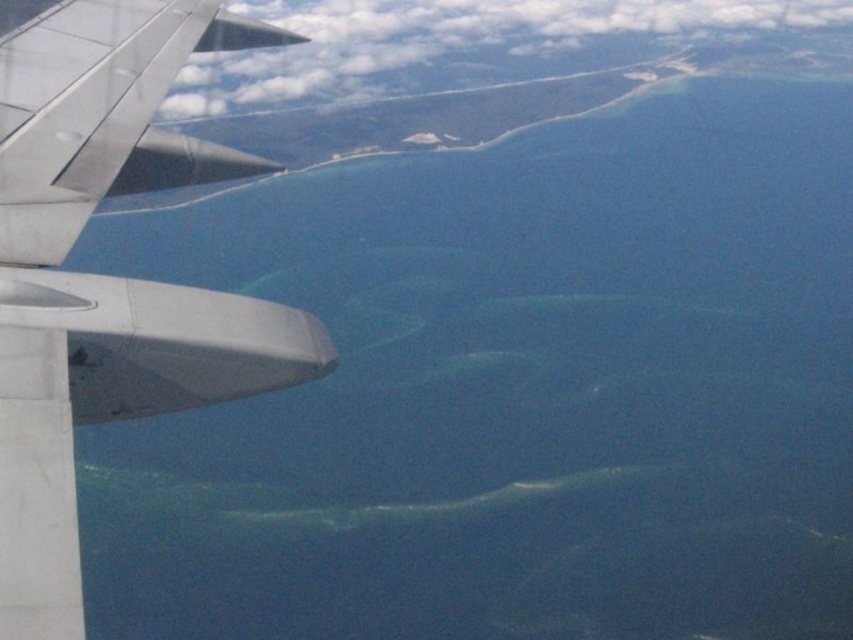
Is point (247, 365) farther from camera compared to point (312, 77)?

No, it is in front of (312, 77).

Is metallic gray wing at left thinner than white fluffy cloud at upper center?

Indeed, metallic gray wing at left has a lesser width compared to white fluffy cloud at upper center.

This screenshot has height=640, width=853. Describe the element at coordinates (106, 275) in the screenshot. I see `metallic gray wing at left` at that location.

At what (x,y) coordinates should I click in order to perform the action: click on metallic gray wing at left. Please return your answer as a coordinate pair (x, y). The image size is (853, 640). Looking at the image, I should click on (x=106, y=275).